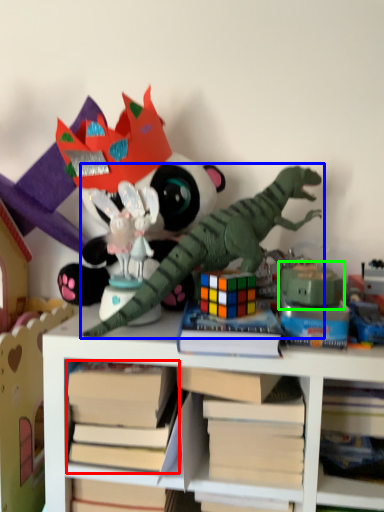
Question: Considering the real-world distances, which object is farthest from book (highlighted by a red box)? toy (highlighted by a blue box) or toy (highlighted by a green box)?

Choices:
 (A) toy
 (B) toy

Answer: (B)